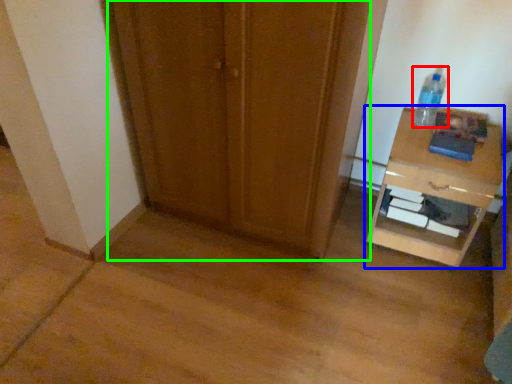
Question: Which object is positioned closest to bottle (highlighted by a red box)? Select from nightstand (highlighted by a blue box) and door (highlighted by a green box).

Choices:
 (A) nightstand
 (B) door

Answer: (A)